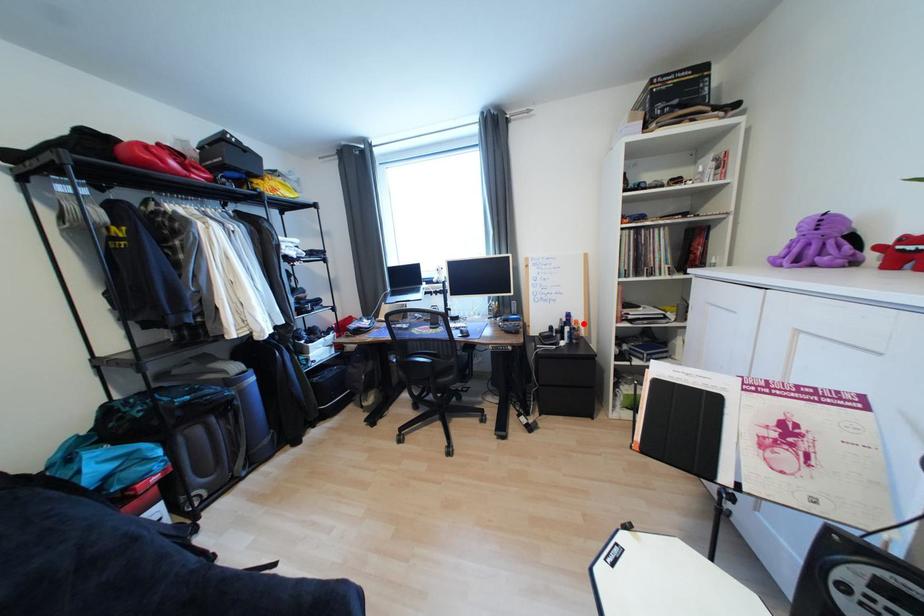
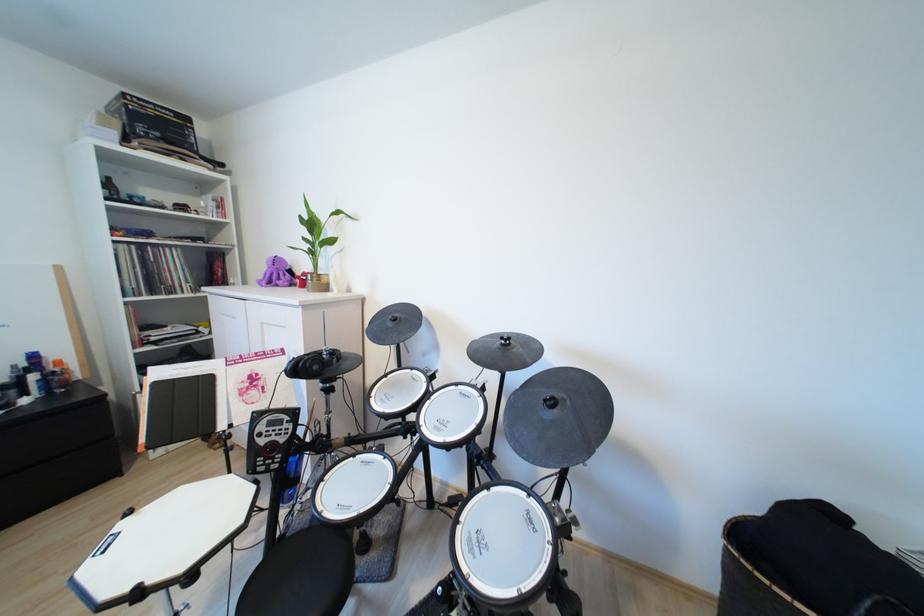
Where in the second image is the point corresponding to the highlighted location from the first image?

(66, 363)